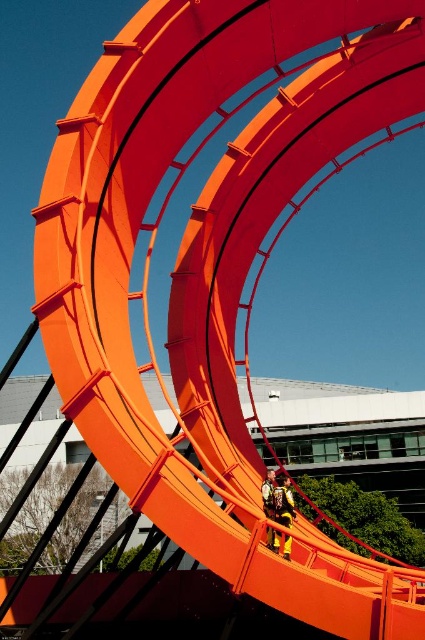
Does yellow fabric at center lie behind yellow fabric jacket at center?

That is True.

What do you see at coordinates (283, 500) in the screenshot?
I see `yellow fabric at center` at bounding box center [283, 500].

I want to click on yellow fabric at center, so click(283, 500).